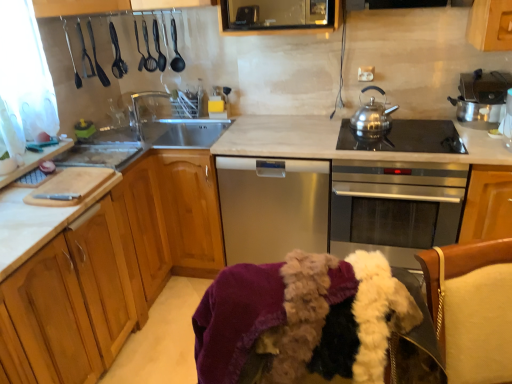
Question: From a real-world perspective, is satin silver dishwasher at center positioned under shiny metallic pot at upper right, the second appliance from the top, based on gravity?

Choices:
 (A) no
 (B) yes

Answer: (B)

Question: Is satin silver dishwasher at center in front of shiny metallic pot at upper right, the second appliance when ordered from left to right?

Choices:
 (A) no
 (B) yes

Answer: (A)

Question: Does satin silver dishwasher at center have a greater width compared to shiny metallic pot at upper right, the second appliance when ordered from left to right?

Choices:
 (A) no
 (B) yes

Answer: (B)

Question: Is satin silver dishwasher at center outside of shiny metallic pot at upper right, arranged as the first appliance when ordered from the bottom?

Choices:
 (A) no
 (B) yes

Answer: (B)

Question: Is satin silver dishwasher at center smaller than shiny metallic pot at upper right, the second appliance when ordered from left to right?

Choices:
 (A) yes
 (B) no

Answer: (B)

Question: Is stainless steel oven at center in front of or behind light wood cabinet at left, which appears as the 1th cabinetry when viewed from the left, in the image?

Choices:
 (A) front
 (B) behind

Answer: (B)

Question: Is stainless steel oven at center spatially inside light wood cabinet at left, the second cabinetry positioned from the right, or outside of it?

Choices:
 (A) outside
 (B) inside

Answer: (A)

Question: Is stainless steel oven at center wider or thinner than light wood cabinet at left, the second cabinetry positioned from the right?

Choices:
 (A) thin
 (B) wide

Answer: (A)

Question: In terms of size, does stainless steel oven at center appear bigger or smaller than light wood cabinet at left, which appears as the 1th cabinetry when viewed from the left?

Choices:
 (A) big
 (B) small

Answer: (B)

Question: From the image's perspective, is white marble countertop at center positioned above or below black glass cooktop at center-right?

Choices:
 (A) above
 (B) below

Answer: (B)

Question: Considering the positions of white marble countertop at center and black glass cooktop at center-right in the image, is white marble countertop at center taller or shorter than black glass cooktop at center-right?

Choices:
 (A) tall
 (B) short

Answer: (A)

Question: Would you say white marble countertop at center is inside or outside black glass cooktop at center-right?

Choices:
 (A) inside
 (B) outside

Answer: (B)

Question: Based on their positions, is white marble countertop at center located to the left or right of black glass cooktop at center-right?

Choices:
 (A) right
 (B) left

Answer: (B)

Question: Is point (375, 109) positioned closer to the camera than point (350, 203)?

Choices:
 (A) closer
 (B) farther

Answer: (B)

Question: In the image, is stainless steel teapot at upper right on the left side or the right side of stainless steel oven at center?

Choices:
 (A) right
 (B) left

Answer: (B)